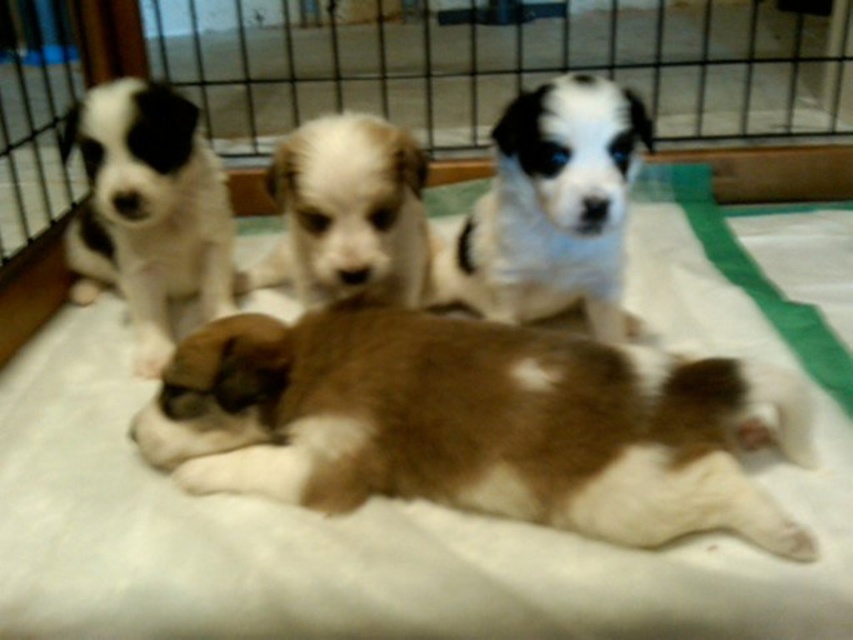
Question: From the image, what is the correct spatial relationship of brown fur at center in relation to white fur puppy at left?

Choices:
 (A) below
 (B) above

Answer: (A)

Question: Observing the image, what is the correct spatial positioning of brown fur at center in reference to metal wire cage at upper center?

Choices:
 (A) above
 (B) below

Answer: (B)

Question: Estimate the real-world distances between objects in this image. Which object is farther from the white fur at center?

Choices:
 (A) white fur puppy at left
 (B) brown fur at center
 (C) metal wire cage at upper center
 (D) white-furred dog at center

Answer: (C)

Question: Which point appears farthest from the camera in this image?

Choices:
 (A) (498, 506)
 (B) (593, 541)

Answer: (A)

Question: Among these objects, which one is nearest to the camera?

Choices:
 (A) white fluffy dog bed at center
 (B) white fur at center
 (C) brown fur at center

Answer: (A)

Question: Where is brown fur at center located in relation to white fur puppy at left in the image?

Choices:
 (A) right
 (B) left

Answer: (A)